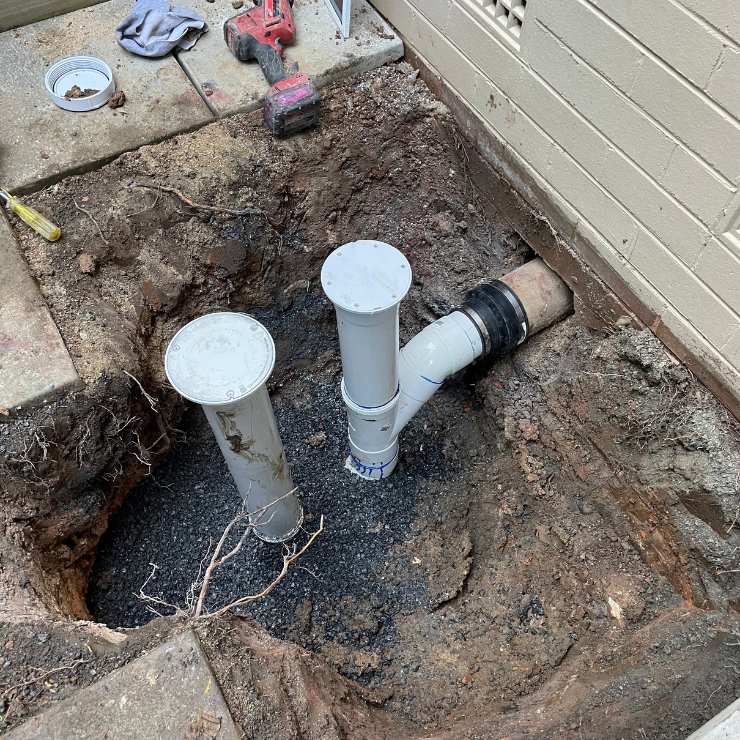
Where is `blue rag`? blue rag is located at coordinates (166, 27).